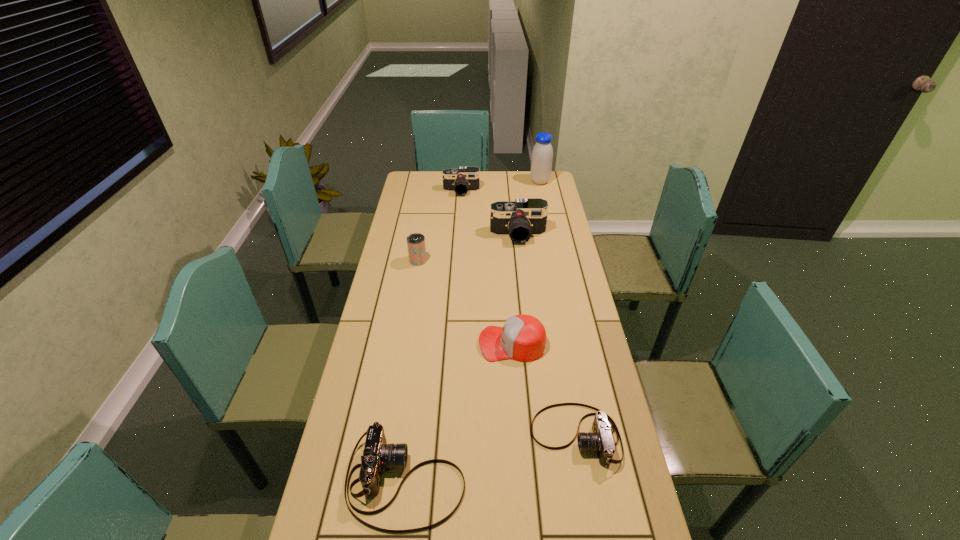
Locate an element on the screen. free location located on the front-facing side of the third nearest object is located at coordinates (455, 343).

At what (x,y) coordinates should I click in order to perform the action: click on vacant area situated 0.080m on the front-facing side of the bigger brown camera. Please return your answer as a coordinate pair (x, y). Image resolution: width=960 pixels, height=540 pixels. Looking at the image, I should click on (496, 480).

I want to click on free location located 0.130m on the front-facing side of the shortest camera, so click(x=484, y=436).

The image size is (960, 540). I want to click on vacant space situated 0.270m on the front-facing side of the shortest camera, so click(x=433, y=436).

I want to click on free space located on the front-facing side of the shortest camera, so [x=473, y=436].

What are the coordinates of `soya milk located at the far edge` in the screenshot? It's located at (542, 155).

At what (x,y) coordinates should I click in order to perform the action: click on camera present at the far edge. Please return your answer as a coordinate pair (x, y). This screenshot has width=960, height=540. Looking at the image, I should click on click(465, 179).

Identify the location of beer can at the left edge. The width and height of the screenshot is (960, 540). (416, 246).

Identify the location of camera that is positioned at the left edge. (377, 454).

In order to click on soya milk present at the right edge in this screenshot , I will do `click(542, 155)`.